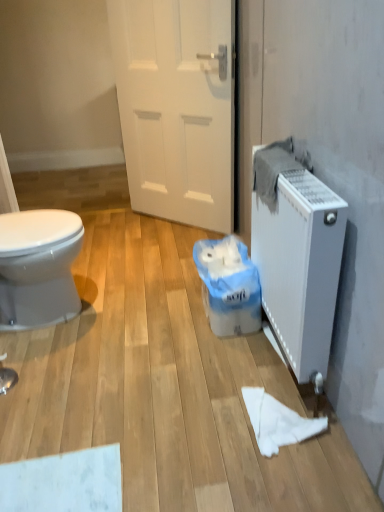
You are a GUI agent. You are given a task and a screenshot of the screen. Output one action in this format:
    pyautogui.click(x=<x>, y=<y>)
    Task: Click on the vacant space to the left of white matte door at center
    
    Given the screenshot: What is the action you would take?
    pyautogui.click(x=127, y=233)